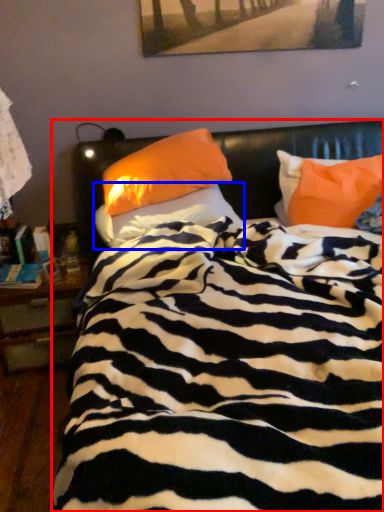
Question: Which object is closer to the camera taking this photo, bed (highlighted by a red box) or pillow (highlighted by a blue box)?

Choices:
 (A) bed
 (B) pillow

Answer: (A)